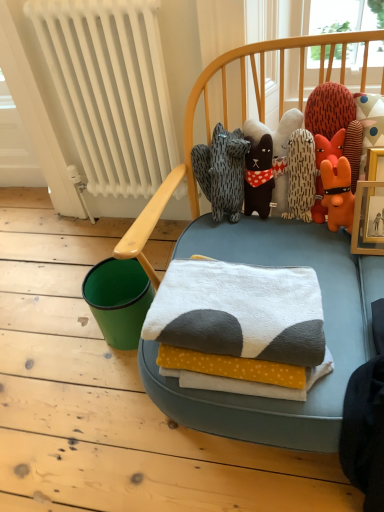
Question: Does white soft towel at center have a smaller size compared to orange plush toy at upper right, which ranks as the 1th toy in right-to-left order?

Choices:
 (A) yes
 (B) no

Answer: (A)

Question: Is white soft towel at center facing towards orange plush toy at upper right, which ranks as the 1th toy in right-to-left order?

Choices:
 (A) no
 (B) yes

Answer: (A)

Question: Is there a large distance between white soft towel at center and orange plush toy at upper right, the second toy when ordered from left to right?

Choices:
 (A) yes
 (B) no

Answer: (B)

Question: Can you confirm if white soft towel at center is thinner than orange plush toy at upper right, the second toy when ordered from left to right?

Choices:
 (A) yes
 (B) no

Answer: (B)

Question: From a real-world perspective, is white soft towel at center under orange plush toy at upper right, which ranks as the 1th toy in right-to-left order?

Choices:
 (A) yes
 (B) no

Answer: (A)

Question: From a real-world perspective, is soft plush toys at center, which appears as the first toy when viewed from the left, positioned above or below orange plush toy at upper right, which ranks as the 1th toy in right-to-left order?

Choices:
 (A) below
 (B) above

Answer: (A)

Question: Considering the positions of soft plush toys at center, which appears as the first toy when viewed from the left, and orange plush toy at upper right, which ranks as the 1th toy in right-to-left order, in the image, is soft plush toys at center, which appears as the first toy when viewed from the left, taller or shorter than orange plush toy at upper right, which ranks as the 1th toy in right-to-left order,?

Choices:
 (A) short
 (B) tall

Answer: (A)

Question: Considering the positions of soft plush toys at center, which appears as the first toy when viewed from the left, and orange plush toy at upper right, the second toy when ordered from left to right, in the image, is soft plush toys at center, which appears as the first toy when viewed from the left, wider or thinner than orange plush toy at upper right, the second toy when ordered from left to right,?

Choices:
 (A) thin
 (B) wide

Answer: (A)

Question: From the image's perspective, is soft plush toys at center, the 2th toy when ordered from right to left, above or below orange plush toy at upper right, which ranks as the 1th toy in right-to-left order?

Choices:
 (A) below
 (B) above

Answer: (A)

Question: Is white painted metal radiator at left inside the boundaries of soft plush toys at center, which appears as the first toy when viewed from the left, or outside?

Choices:
 (A) inside
 (B) outside

Answer: (B)

Question: From a real-world perspective, relative to soft plush toys at center, which appears as the first toy when viewed from the left, is white painted metal radiator at left vertically above or below?

Choices:
 (A) above
 (B) below

Answer: (A)

Question: From the image's perspective, is white painted metal radiator at left positioned above or below soft plush toys at center, which appears as the first toy when viewed from the left?

Choices:
 (A) above
 (B) below

Answer: (A)

Question: Based on their positions, is white painted metal radiator at left located to the left or right of soft plush toys at center, which appears as the first toy when viewed from the left?

Choices:
 (A) right
 (B) left

Answer: (B)

Question: From the image's perspective, is soft plush toys at center, which appears as the first toy when viewed from the left, located above or below white soft towel at center?

Choices:
 (A) above
 (B) below

Answer: (A)

Question: In terms of height, does soft plush toys at center, the 2th toy when ordered from right to left, look taller or shorter compared to white soft towel at center?

Choices:
 (A) tall
 (B) short

Answer: (A)